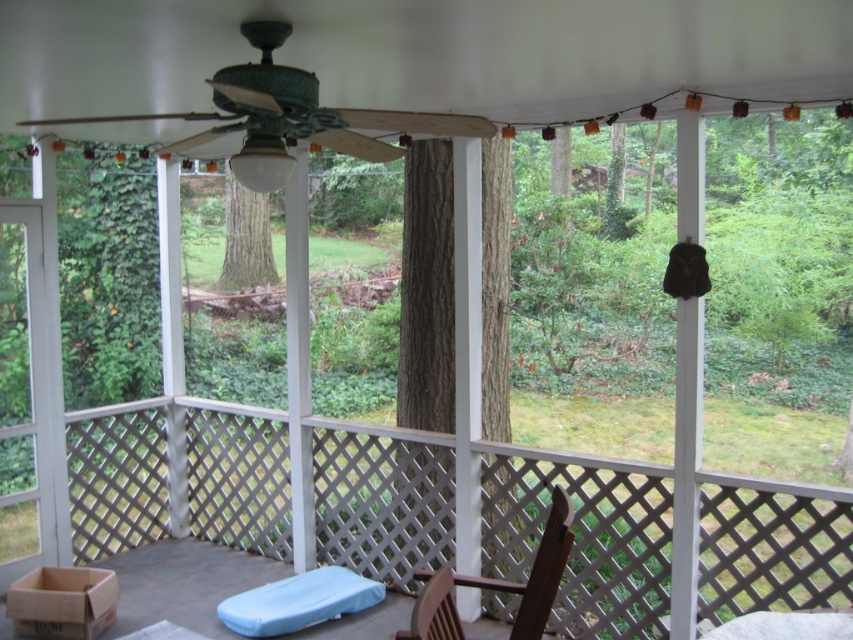
Question: Is clear glass door at left in front of brown wooden chair at center?

Choices:
 (A) yes
 (B) no

Answer: (B)

Question: Considering the real-world distances, which object is farthest from the brown wooden chair at center?

Choices:
 (A) wooden rocking chair at center
 (B) clear glass door at left

Answer: (B)

Question: Is wooden rocking chair at center smaller than clear glass door at left?

Choices:
 (A) yes
 (B) no

Answer: (B)

Question: Where is wooden rocking chair at center located in relation to clear glass door at left in the image?

Choices:
 (A) left
 (B) right

Answer: (B)

Question: Which object is positioned closest to the brown wooden chair at center?

Choices:
 (A) wooden rocking chair at center
 (B) clear glass door at left

Answer: (A)

Question: Which of the following is the farthest from the observer?

Choices:
 (A) (759, 477)
 (B) (544, 580)
 (C) (15, 218)

Answer: (C)